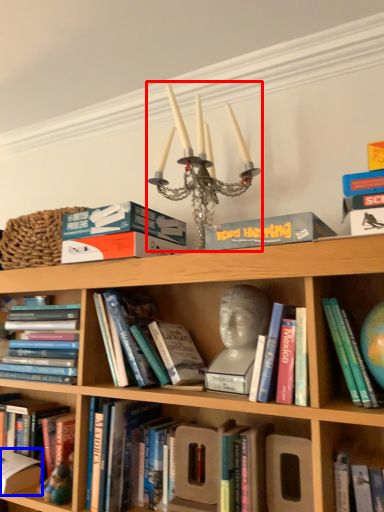
Question: Which point is further to the camera, candle holder (highlighted by a red box) or paperback book (highlighted by a blue box)?

Choices:
 (A) candle holder
 (B) paperback book

Answer: (B)